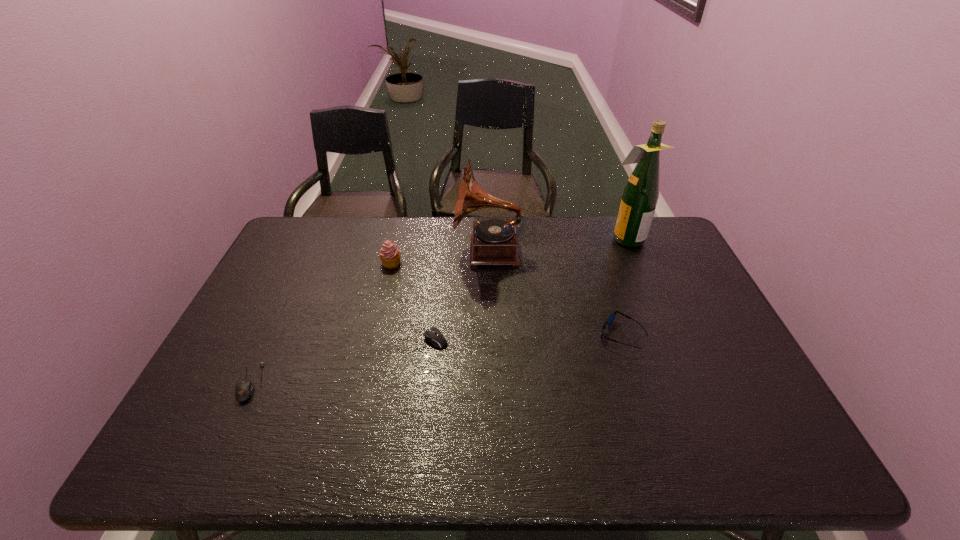
I want to click on free spot located on the front of the right mouse, so click(x=413, y=404).

Find the location of a particular element. The image size is (960, 540). blank space located on the right of the nearest object is located at coordinates (365, 382).

Locate an element on the screen. The height and width of the screenshot is (540, 960). liquor that is positioned at the far edge is located at coordinates (641, 193).

Where is `phonograph_record that is at the far edge`? Image resolution: width=960 pixels, height=540 pixels. phonograph_record that is at the far edge is located at coordinates (494, 241).

At what (x,y) coordinates should I click in order to perform the action: click on cupcake that is at the far edge. Please return your answer as a coordinate pair (x, y). The image size is (960, 540). Looking at the image, I should click on (389, 254).

What are the coordinates of `object positioned at the left edge` in the screenshot? It's located at (244, 389).

Identify the location of object that is at the right edge. This screenshot has height=540, width=960. (641, 193).

This screenshot has width=960, height=540. Find the location of `object that is at the far right corner`. object that is at the far right corner is located at coordinates (641, 193).

You are a GUI agent. You are given a task and a screenshot of the screen. Output one action in this format:
    pyautogui.click(x=<x>, y=<y>)
    Task: Click on the free location at the far edge of the desktop
    Image resolution: width=960 pixels, height=540 pixels.
    Given the screenshot: What is the action you would take?
    pyautogui.click(x=568, y=221)

In the image, there is a desktop. At what (x,y) coordinates should I click in order to perform the action: click on free region at the near edge. Please return your answer as a coordinate pair (x, y). Image resolution: width=960 pixels, height=540 pixels. Looking at the image, I should click on (477, 439).